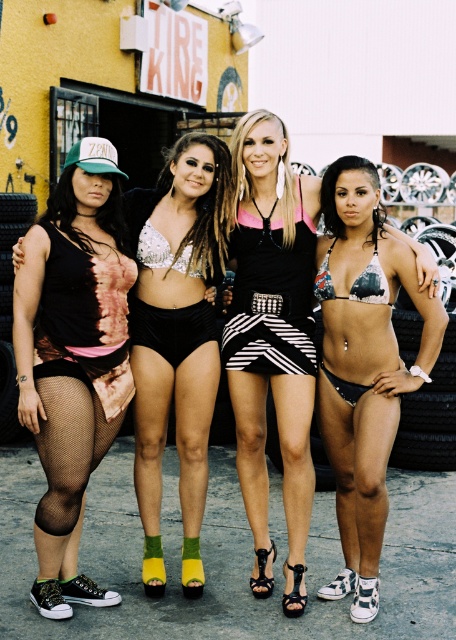
Is point (304, 520) in front of point (184, 380)?

Yes, point (304, 520) is in front of point (184, 380).

Which is more to the right, printed bikini top at center or matte black shorts at center?

printed bikini top at center

The width and height of the screenshot is (456, 640). I want to click on printed bikini top at center, so click(271, 333).

Locate an element on the screen. Image resolution: width=456 pixels, height=640 pixels. printed bikini top at center is located at coordinates (271, 333).

Does printed bikini top at center have a greater height compared to fishnet stockings at lower left?

Indeed, printed bikini top at center has a greater height compared to fishnet stockings at lower left.

You are a GUI agent. You are given a task and a screenshot of the screen. Output one action in this format:
    pyautogui.click(x=<x>, y=<y>)
    Task: Click on the printed bikini top at center
    
    Given the screenshot: What is the action you would take?
    pyautogui.click(x=271, y=333)

Is matte black shorts at center in front of black velvet underwear at center?

Yes, it is in front of black velvet underwear at center.

Does point (181, 282) come behind point (180, 337)?

Yes, point (181, 282) is farther from viewer.

Identify the location of matte black shorts at center. (185, 218).